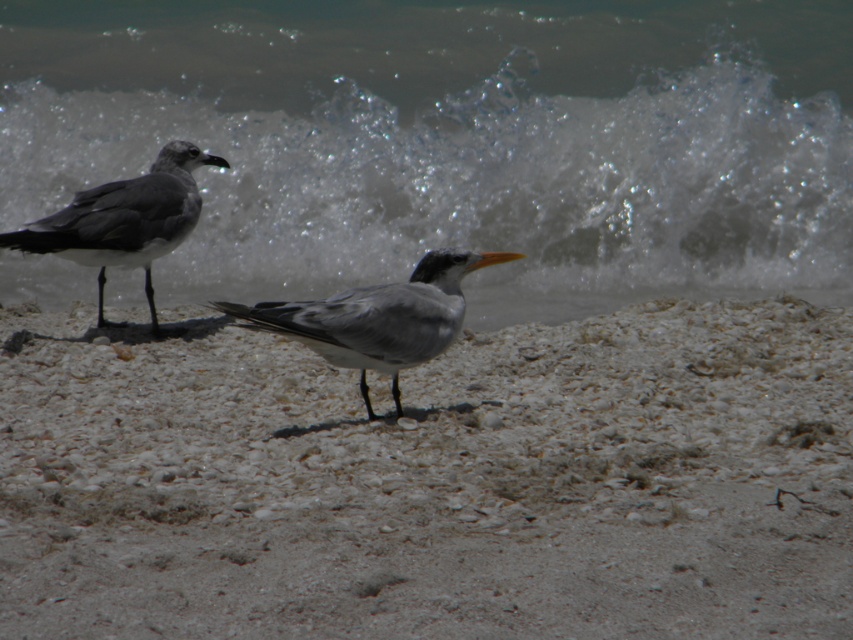
Is clear water at upper center thinner than gray matte bird at center?

No, clear water at upper center is not thinner than gray matte bird at center.

Who is more forward, (x=161, y=96) or (x=322, y=353)?

Point (x=322, y=353) is more forward.

At what (x,y) coordinates should I click in order to perform the action: click on clear water at upper center. Please return your answer as a coordinate pair (x, y). The width and height of the screenshot is (853, 640). Looking at the image, I should click on (454, 140).

Does gray matte bird at center have a smaller size compared to gray matte seagull at left?

Correct, gray matte bird at center occupies less space than gray matte seagull at left.

Between gray matte bird at center and gray matte seagull at left, which one appears on the left side from the viewer's perspective?

From the viewer's perspective, gray matte seagull at left appears more on the left side.

Where is `gray matte bird at center`? gray matte bird at center is located at coordinates (378, 317).

Who is more distant from viewer, (483, 540) or (35, 248)?

The point (35, 248) is more distant.

Does white sandy beach at center have a lesser width compared to gray matte seagull at left?

In fact, white sandy beach at center might be wider than gray matte seagull at left.

Between point (403, 452) and point (137, 253), which one is positioned in front?

Point (403, 452) is more forward.

Find the location of a particular element. white sandy beach at center is located at coordinates (434, 483).